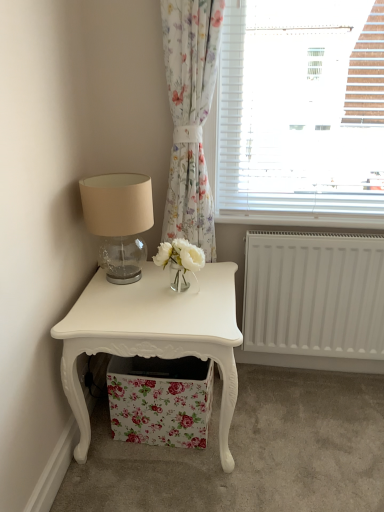
Question: From a real-world perspective, is white glossy nightstand at lower left above or below white plastic radiator at lower center?

Choices:
 (A) below
 (B) above

Answer: (A)

Question: In terms of width, does white glossy nightstand at lower left look wider or thinner when compared to white plastic radiator at lower center?

Choices:
 (A) wide
 (B) thin

Answer: (A)

Question: Which is nearer to the white plastic radiator at lower center?

Choices:
 (A) matte glass table lamp at upper left
 (B) white matte radiator at lower right
 (C) white glossy nightstand at lower left
 (D) floral fabric storage box at lower center
 (E) floral fabric curtain at upper center

Answer: (B)

Question: Which is farther from the white plastic radiator at lower center?

Choices:
 (A) white matte radiator at lower right
 (B) white glossy nightstand at lower left
 (C) matte glass table lamp at upper left
 (D) floral fabric curtain at upper center
 (E) floral fabric storage box at lower center

Answer: (E)